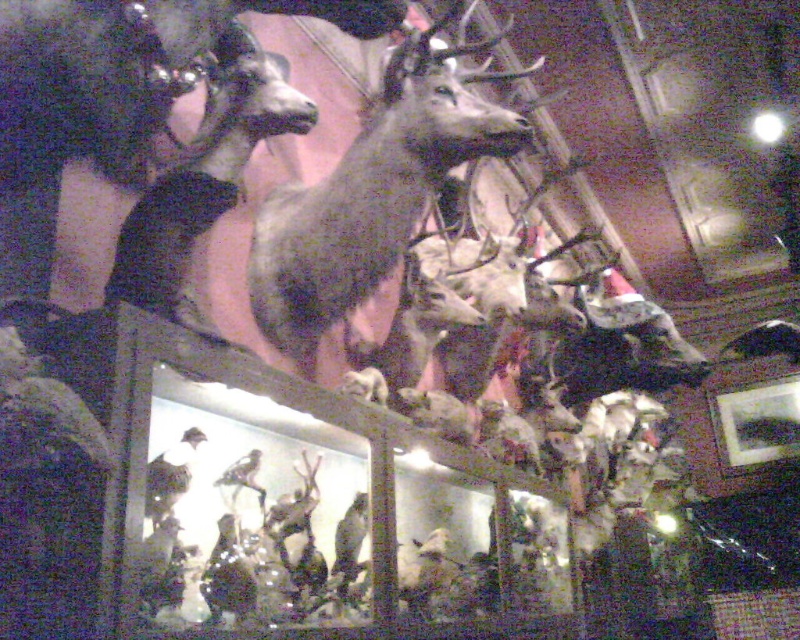
You are a museum visitor who wants to take a photo of both the shiny brown deer at center and the shiny brown deer at upper left. Since you want both to be in the frame, which deer should you position closer to the camera to ensure both fit in the photo?

To ensure both the shiny brown deer at center and the shiny brown deer at upper left fit in the photo, you should position the shiny brown deer at upper left closer to the camera. This is because the shiny brown deer at center is wider than the shiny brown deer at upper left, so moving the smaller one forward can help balance their sizes in the frame.

You are a visitor standing in front of the display. You notice the shiny brown deer at center and the shiny brown deer at upper left. Which deer appears closer to you?

The shiny brown deer at center appears closer to you because the shiny brown deer at upper left is behind it.

You are a museum visitor observing the display of deer heads. You notice two shiny brown deer at center and shiny brown deer at upper left. Which one do you think has larger antlers?

The shiny brown deer at center has larger antlers because it is bigger than the shiny brown deer at upper left.